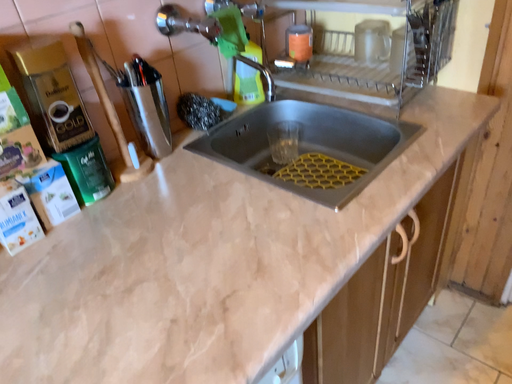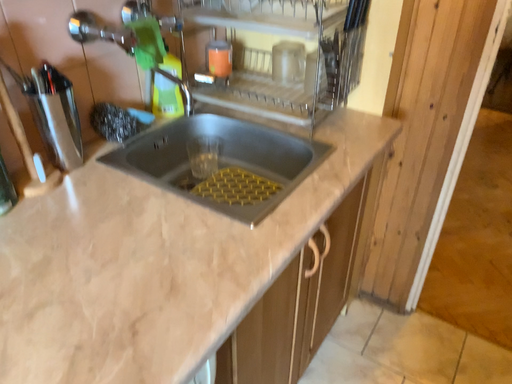
Question: How did the camera likely rotate when shooting the video?

Choices:
 (A) rotated left
 (B) rotated right

Answer: (B)